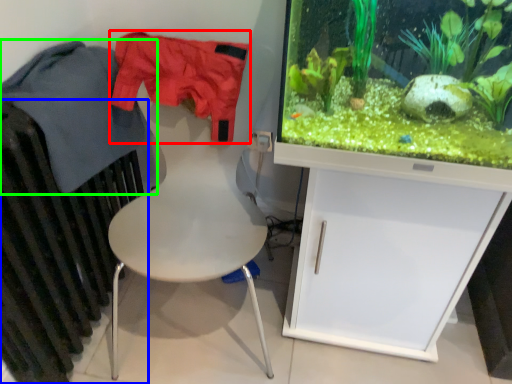
Question: Which object is positioned closest to clothing (highlighted by a red box)? Select from radiator (highlighted by a blue box) and clothing (highlighted by a green box).

Choices:
 (A) radiator
 (B) clothing

Answer: (B)